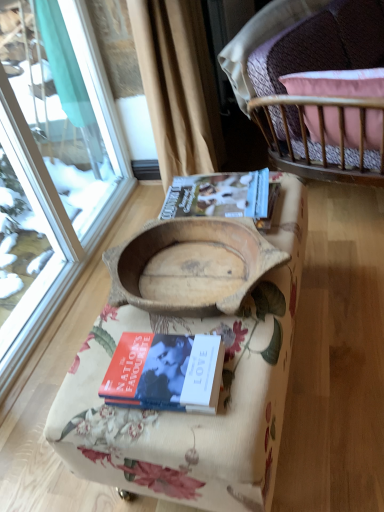
You are a GUI agent. You are given a task and a screenshot of the screen. Output one action in this format:
    pyautogui.click(x=<x>, y=<y>)
    Task: Click on the free spot below wooden cradle at center (from a real-world perspective)
    Image resolution: width=384 pixels, height=512 pixels.
    Given the screenshot: What is the action you would take?
    pyautogui.click(x=197, y=275)